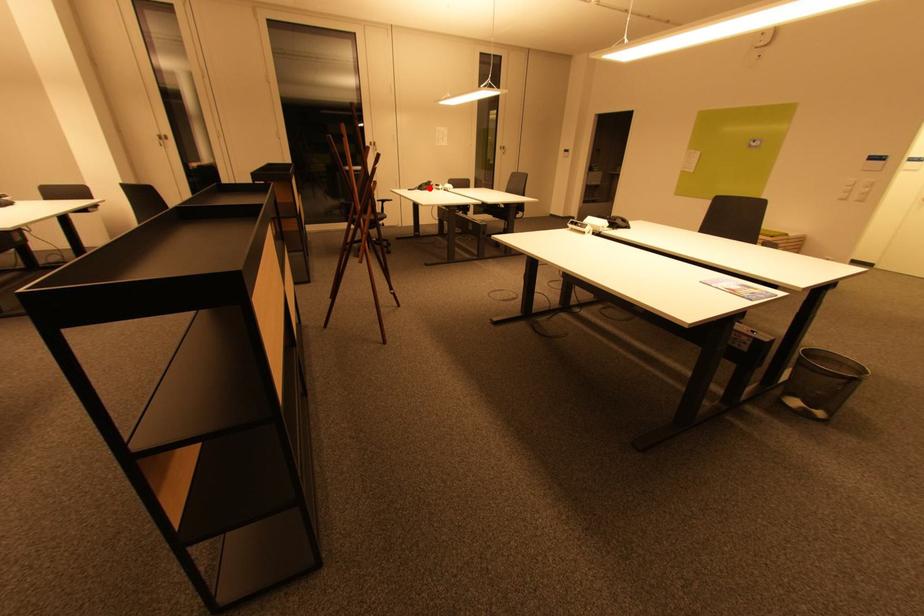
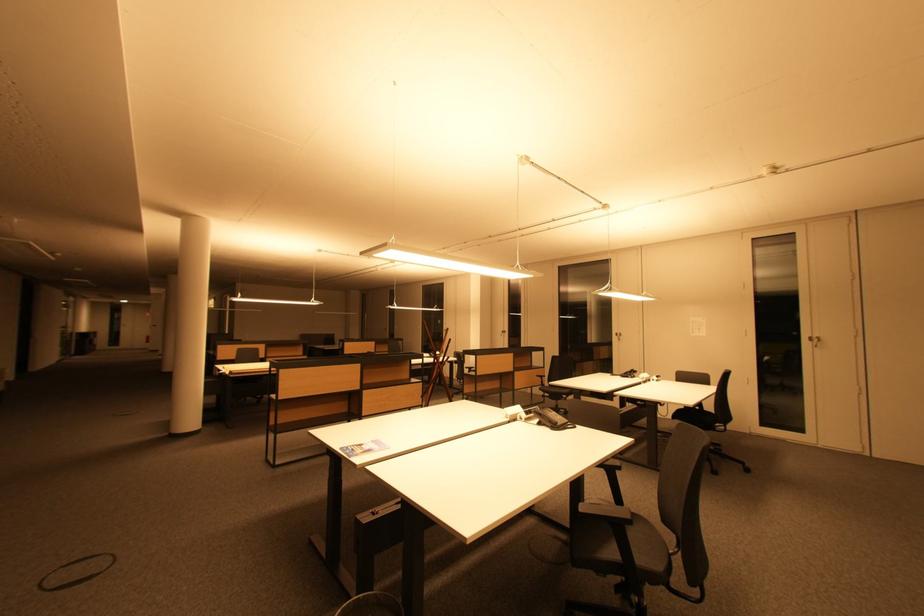
The point at the highlighted location is marked in the first image. Where is the corresponding point in the second image?

(635, 376)